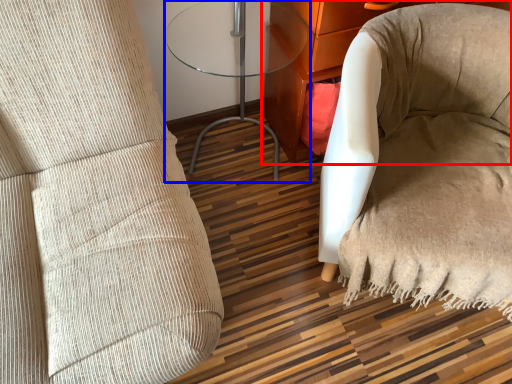
Question: Which object is closer to the camera taking this photo, furniture (highlighted by a red box) or table (highlighted by a blue box)?

Choices:
 (A) furniture
 (B) table

Answer: (B)